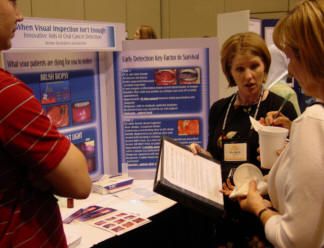
Where is `pictures`? The image size is (324, 248). pictures is located at coordinates (116, 226).